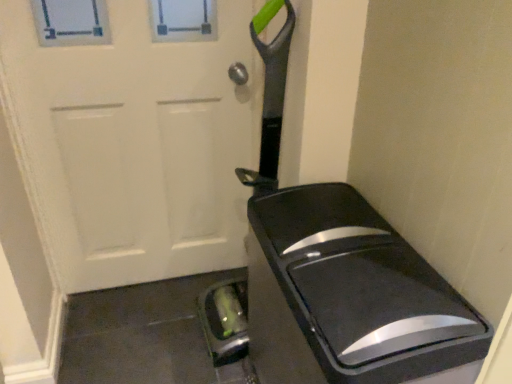
The width and height of the screenshot is (512, 384). What do you see at coordinates (137, 134) in the screenshot? I see `white matte door at center` at bounding box center [137, 134].

Measure the distance between white matte door at center and camera.

white matte door at center and camera are 1.18 meters apart from each other.

Identify the location of white matte door at center. This screenshot has width=512, height=384. (137, 134).

Where is `black glossy trash can at center`? black glossy trash can at center is located at coordinates (348, 295).

In order to face black glossy trash can at center, should I rotate leftwards or rightwards?

Turn right approximately 9.628 degrees to face it.

Describe the element at coordinates (348, 295) in the screenshot. I see `black glossy trash can at center` at that location.

The width and height of the screenshot is (512, 384). In order to click on white matte door at center in this screenshot , I will do `click(137, 134)`.

Between white matte door at center and black glossy trash can at center, which one appears on the right side from the viewer's perspective?

black glossy trash can at center is more to the right.

Is white matte door at center closer to camera compared to black glossy trash can at center?

No, white matte door at center is further to the viewer.

Which is in front, point (182, 207) or point (462, 354)?

The point (462, 354) is closer.

From the image's perspective, is white matte door at center located above or below black glossy trash can at center?

white matte door at center is above black glossy trash can at center.

From a real-world perspective, relative to black glossy trash can at center, is white matte door at center vertically above or below?

white matte door at center is above black glossy trash can at center.

Looking at their sizes, would you say white matte door at center is wider or thinner than black glossy trash can at center?

In the image, white matte door at center appears to be more narrow than black glossy trash can at center.

Which of these two, white matte door at center or black glossy trash can at center, stands taller?

Standing taller between the two is white matte door at center.

Who is bigger, white matte door at center or black glossy trash can at center?

black glossy trash can at center.

Is white matte door at center not inside black glossy trash can at center?

That's correct, white matte door at center is outside of black glossy trash can at center.

Can you see white matte door at center touching black glossy trash can at center?

white matte door at center and black glossy trash can at center are not in contact.

Is white matte door at center aimed at black glossy trash can at center?

Yes, white matte door at center is facing black glossy trash can at center.

How many degrees apart are the facing directions of white matte door at center and black glossy trash can at center?

87.6 degrees.

What are the coordinates of `door on the left side of black glossy trash can at center` in the screenshot? It's located at (137, 134).

Does black glossy trash can at center appear on the left side of white matte door at center?

No.

Considering their positions, is black glossy trash can at center located in front of or behind white matte door at center?

black glossy trash can at center is in front of white matte door at center.

Which is behind, point (387, 242) or point (167, 128)?

The point (167, 128) is more distant.

From the image's perspective, is black glossy trash can at center below white matte door at center?

Yes.

From a real-world perspective, is black glossy trash can at center physically located above or below white matte door at center?

Clearly, from a real-world perspective, black glossy trash can at center is below white matte door at center.

Can you confirm if black glossy trash can at center is thinner than white matte door at center?

In fact, black glossy trash can at center might be wider than white matte door at center.

Which of these two, black glossy trash can at center or white matte door at center, stands taller?

white matte door at center.

Which of these two, black glossy trash can at center or white matte door at center, is smaller?

With smaller size is white matte door at center.

Is black glossy trash can at center located outside white matte door at center?

Yes, black glossy trash can at center is not within white matte door at center.

Is black glossy trash can at center in contact with white matte door at center?

black glossy trash can at center and white matte door at center are clearly separated.

Is black glossy trash can at center facing away from white matte door at center?

black glossy trash can at center does not have its back to white matte door at center.

Looking at this image, can you tell me how much black glossy trash can at center and white matte door at center differ in facing direction?

black glossy trash can at center and white matte door at center are facing 87.6 degrees away from each other.

Where is `appliance below the white matte door at center (from a real-world perspective)`? The image size is (512, 384). appliance below the white matte door at center (from a real-world perspective) is located at coordinates (348, 295).

Where is `appliance located in front of the white matte door at center`? The width and height of the screenshot is (512, 384). appliance located in front of the white matte door at center is located at coordinates (348, 295).

Image resolution: width=512 pixels, height=384 pixels. I want to click on door located above the black glossy trash can at center (from a real-world perspective), so coord(137,134).